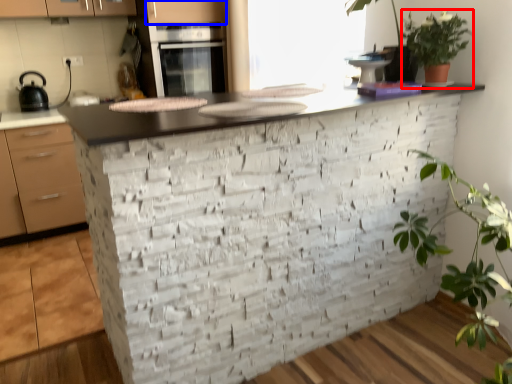
Question: Which object is closer to the camera taking this photo, vegetation (highlighted by a red box) or cabinetry (highlighted by a blue box)?

Choices:
 (A) vegetation
 (B) cabinetry

Answer: (A)